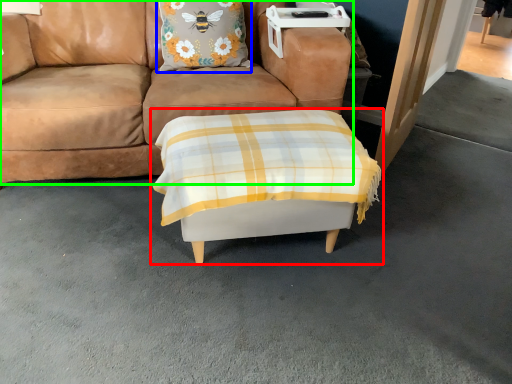
Question: Based on their relative distances, which object is farther from table (highlighted by a red box)? Choose from pillow (highlighted by a blue box) and studio couch (highlighted by a green box).

Choices:
 (A) pillow
 (B) studio couch

Answer: (A)